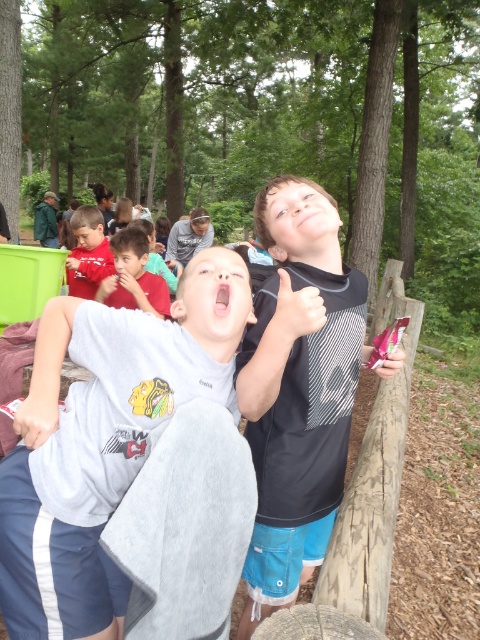
Between matte red shirt at center and matte red shirt at upper left, which one is positioned lower?

matte red shirt at center is below.

Find the location of a particular element. matte red shirt at center is located at coordinates (133, 276).

Find the location of a particular element. The image size is (480, 640). matte red shirt at center is located at coordinates (133, 276).

Can you confirm if gray cotton shirt at center is shorter than matte red shirt at upper left?

Incorrect, gray cotton shirt at center's height does not fall short of matte red shirt at upper left's.

Does gray cotton shirt at center have a smaller size compared to matte red shirt at upper left?

Yes.

Measure the distance between point (x=0, y=477) and camera.

Point (x=0, y=477) is 3.79 feet away from camera.

I want to click on gray cotton shirt at center, so click(x=103, y=440).

Is gray cotton shirt at center taller than matte red shirt at center?

Indeed, gray cotton shirt at center has a greater height compared to matte red shirt at center.

Is gray cotton shirt at center thinner than matte red shirt at center?

Yes, gray cotton shirt at center is thinner than matte red shirt at center.

This screenshot has width=480, height=640. Describe the element at coordinates (103, 440) in the screenshot. I see `gray cotton shirt at center` at that location.

The image size is (480, 640). What are the coordinates of `gray cotton shirt at center` in the screenshot? It's located at (103, 440).